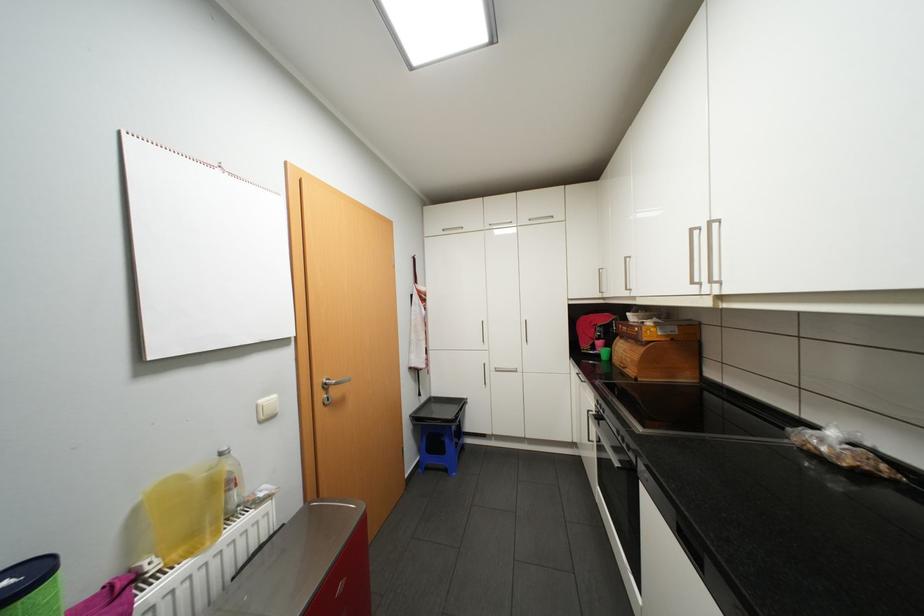
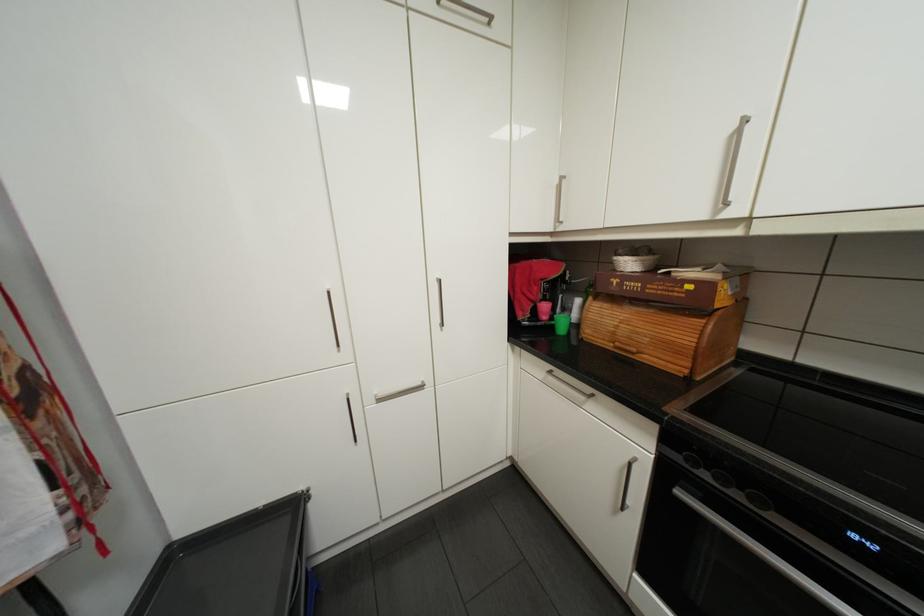
Find the pixel in the second image that matches the point at 468,402 in the first image.

(300, 507)